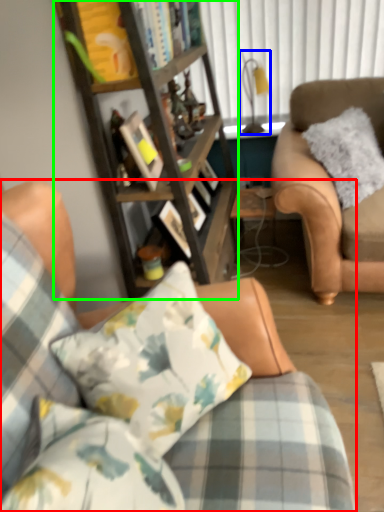
Question: Based on their relative distances, which object is nearer to studio couch (highlighted by a red box)? Choose from lamp (highlighted by a blue box) and cabinetry (highlighted by a green box).

Choices:
 (A) lamp
 (B) cabinetry

Answer: (B)